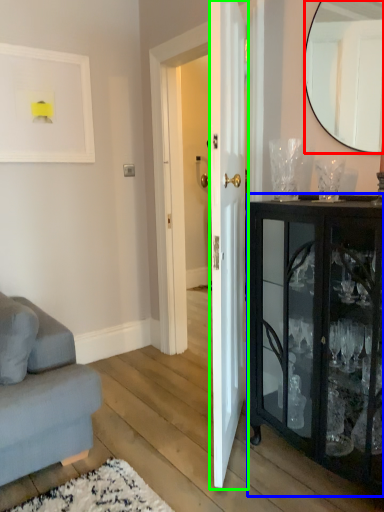
Question: Based on their relative distances, which object is farther from mirror (highlighted by a red box)? Choose from cabinetry (highlighted by a blue box) and door (highlighted by a green box).

Choices:
 (A) cabinetry
 (B) door

Answer: (A)